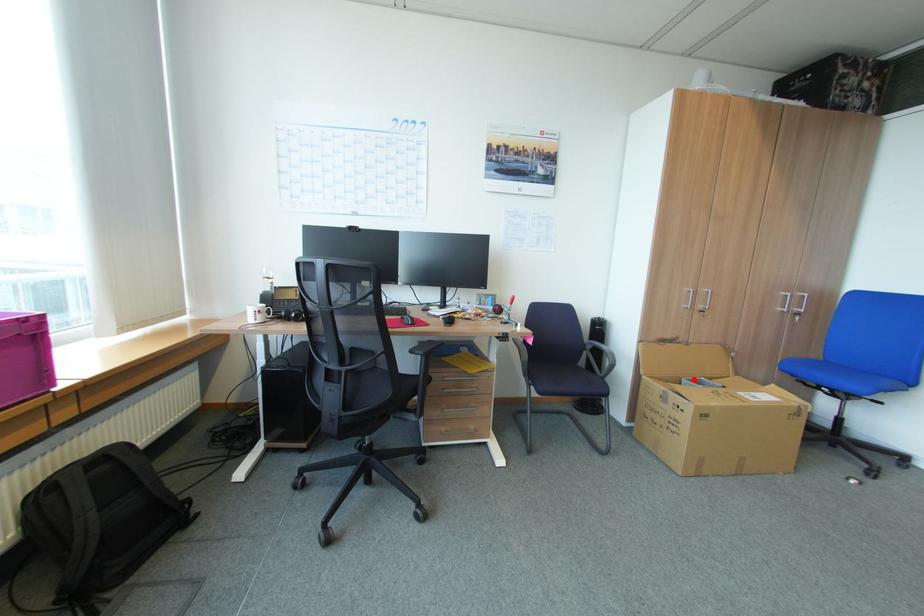
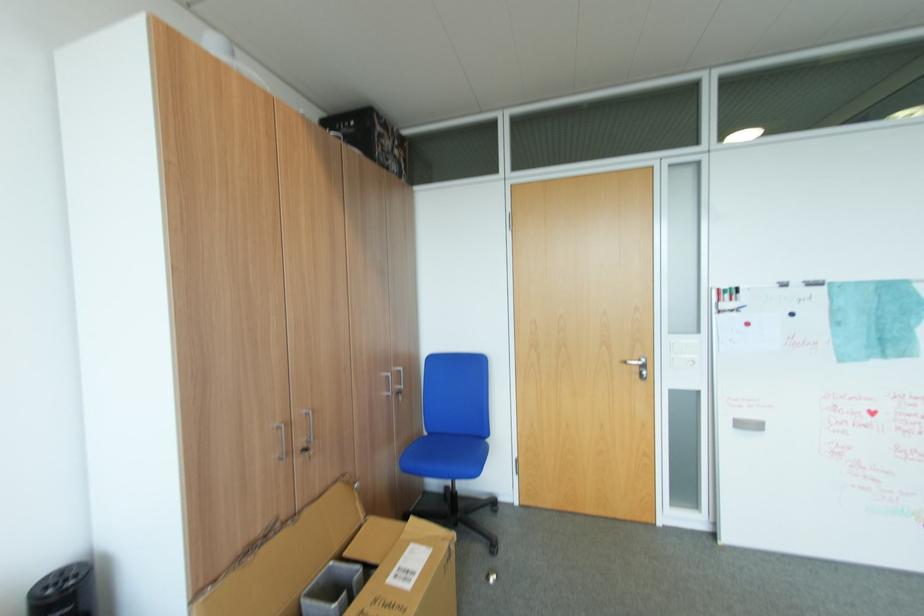
Locate, in the second image, the point that corresponds to the highlighted location in the first image.

(317, 593)